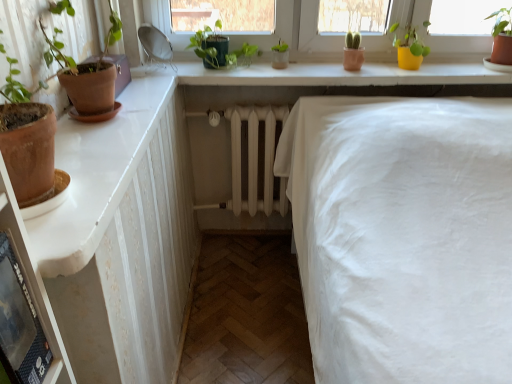
The height and width of the screenshot is (384, 512). What are the coordinates of `vacant area that lies between green matte plant at upper center, acting as the 1th houseplant starting from the left, and yellow matte pot at upper right, positioned as the 2th houseplant in left-to-right order` in the screenshot? It's located at (322, 70).